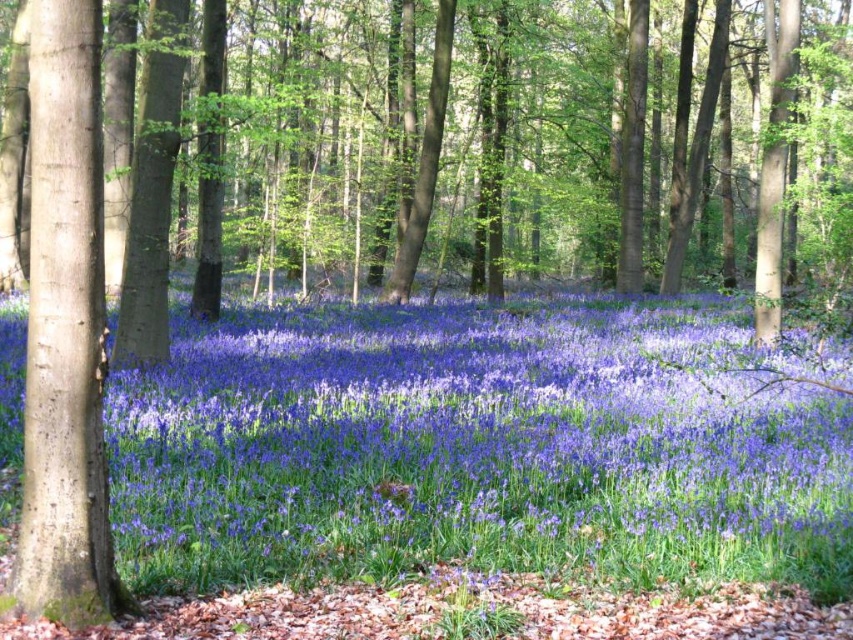
Is purple matte flower at center below smooth brown tree trunk at left?

Correct, purple matte flower at center is located below smooth brown tree trunk at left.

Locate an element on the screen. purple matte flower at center is located at coordinates (479, 445).

Measure the distance between point (851,468) and camera.

The distance of point (851,468) from camera is 8.47 meters.

The width and height of the screenshot is (853, 640). What are the coordinates of `purple matte flower at center` in the screenshot? It's located at (479, 445).